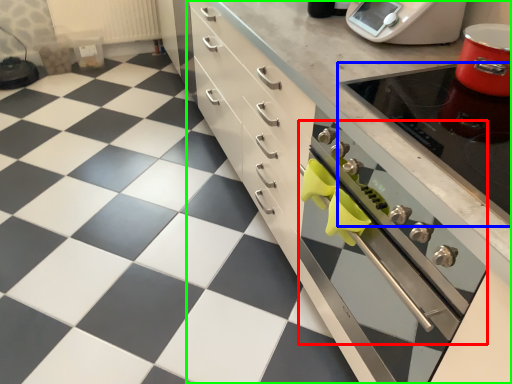
Question: Which object is the farthest from oven (highlighted by a red box)? Choose among these: appliance (highlighted by a blue box) or cabinetry (highlighted by a green box).

Choices:
 (A) appliance
 (B) cabinetry

Answer: (A)